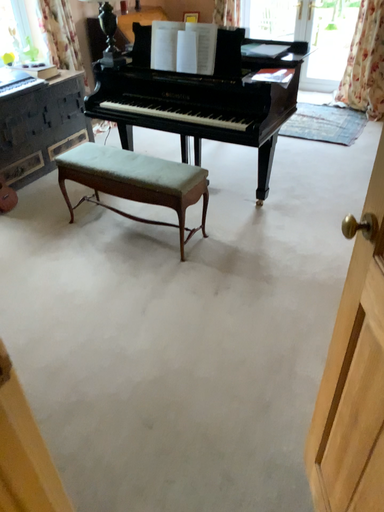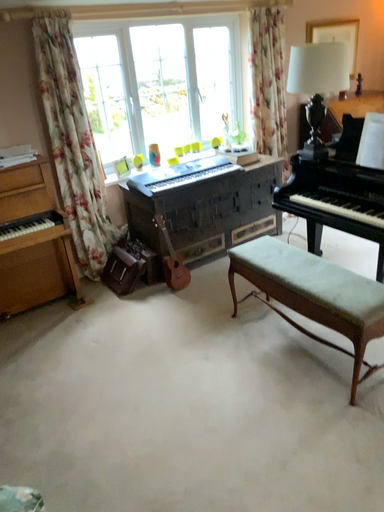
Question: Which way did the camera rotate in the video?

Choices:
 (A) rotated right
 (B) rotated left

Answer: (B)